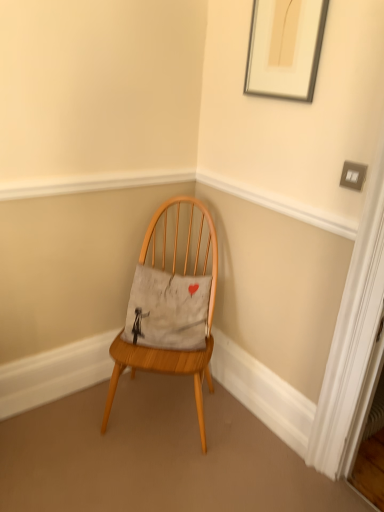
Question: Considering the relative sizes of wooden chair at center and silver metallic picture frame at upper right in the image provided, is wooden chair at center thinner than silver metallic picture frame at upper right?

Choices:
 (A) no
 (B) yes

Answer: (A)

Question: Is wooden chair at center turned away from silver metallic picture frame at upper right?

Choices:
 (A) no
 (B) yes

Answer: (A)

Question: Is wooden chair at center beside silver metallic picture frame at upper right?

Choices:
 (A) yes
 (B) no

Answer: (B)

Question: Would you say wooden chair at center is a long distance from silver metallic picture frame at upper right?

Choices:
 (A) yes
 (B) no

Answer: (B)

Question: From the image's perspective, is wooden chair at center located beneath silver metallic picture frame at upper right?

Choices:
 (A) yes
 (B) no

Answer: (A)

Question: Does wooden chair at center have a greater width compared to silver metallic picture frame at upper right?

Choices:
 (A) no
 (B) yes

Answer: (B)

Question: From the image's perspective, would you say silver metallic picture frame at upper right is positioned over wooden chair at center?

Choices:
 (A) no
 (B) yes

Answer: (B)

Question: Can you confirm if silver metallic picture frame at upper right is taller than wooden chair at center?

Choices:
 (A) yes
 (B) no

Answer: (B)

Question: From the image's perspective, is silver metallic picture frame at upper right located beneath wooden chair at center?

Choices:
 (A) no
 (B) yes

Answer: (A)

Question: Does silver metallic picture frame at upper right have a smaller size compared to wooden chair at center?

Choices:
 (A) no
 (B) yes

Answer: (B)

Question: Would you say silver metallic picture frame at upper right is outside wooden chair at center?

Choices:
 (A) no
 (B) yes

Answer: (B)

Question: Is silver metallic picture frame at upper right wider than wooden chair at center?

Choices:
 (A) no
 (B) yes

Answer: (A)

Question: Can wooden chair at center be found inside gray cotton pillow at center?

Choices:
 (A) yes
 (B) no

Answer: (B)